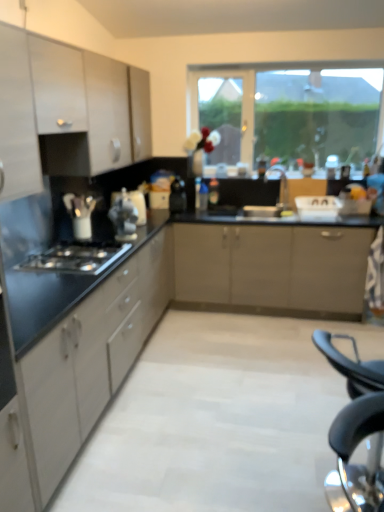
Question: Could you tell me if white glossy kettle at center, placed as the second appliance when sorted from right to left, is facing matte black countertop at left, which ranks as the first cabinetry in bottom-to-top order?

Choices:
 (A) yes
 (B) no

Answer: (B)

Question: From a real-world perspective, is white glossy kettle at center, which is counted as the 3th appliance, starting from the left, positioned over matte black countertop at left, arranged as the third cabinetry when viewed from the top, based on gravity?

Choices:
 (A) yes
 (B) no

Answer: (A)

Question: Is white glossy kettle at center, acting as the 3th appliance starting from the front, taller than matte black countertop at left, which ranks as the first cabinetry in bottom-to-top order?

Choices:
 (A) yes
 (B) no

Answer: (B)

Question: Is white glossy kettle at center, the second appliance positioned from the back, smaller than matte black countertop at left, arranged as the third cabinetry when viewed from the top?

Choices:
 (A) yes
 (B) no

Answer: (A)

Question: Is white glossy kettle at center, placed as the second appliance when sorted from right to left, behind matte black countertop at left, which ranks as the first cabinetry in bottom-to-top order?

Choices:
 (A) yes
 (B) no

Answer: (A)

Question: Looking at their shapes, would you say matte black countertop at left, arranged as the third cabinetry when viewed from the top, is wider or thinner than matte white cabinet at left, which ranks as the 2th cabinetry in top-to-bottom order?

Choices:
 (A) wide
 (B) thin

Answer: (A)

Question: Visually, is matte black countertop at left, which ranks as the first cabinetry in bottom-to-top order, positioned to the left or to the right of matte white cabinet at left, which ranks as the 2th cabinetry in top-to-bottom order?

Choices:
 (A) left
 (B) right

Answer: (B)

Question: From their relative heights in the image, would you say matte black countertop at left, arranged as the third cabinetry when viewed from the top, is taller or shorter than matte white cabinet at left, which ranks as the 2th cabinetry in top-to-bottom order?

Choices:
 (A) short
 (B) tall

Answer: (B)

Question: Is point (89, 423) closer or farther from the camera than point (21, 48)?

Choices:
 (A) closer
 (B) farther

Answer: (B)

Question: Does point (41, 66) appear closer or farther from the camera than point (357, 401)?

Choices:
 (A) closer
 (B) farther

Answer: (B)

Question: In terms of size, does satin silver cabinet at upper left, marked as the 3th cabinetry in a bottom-to-top arrangement, appear bigger or smaller than black plastic folding chair at lower right?

Choices:
 (A) small
 (B) big

Answer: (B)

Question: From the image's perspective, is satin silver cabinet at upper left, marked as the 3th cabinetry in a bottom-to-top arrangement, positioned above or below black plastic folding chair at lower right?

Choices:
 (A) below
 (B) above

Answer: (B)

Question: Is satin silver cabinet at upper left, marked as the 3th cabinetry in a bottom-to-top arrangement, to the left or to the right of black plastic folding chair at lower right in the image?

Choices:
 (A) left
 (B) right

Answer: (A)

Question: Is matte silver faucet at center wider or thinner than black plastic folding chair at lower right?

Choices:
 (A) wide
 (B) thin

Answer: (B)

Question: From a real-world perspective, is matte silver faucet at center positioned above or below black plastic folding chair at lower right?

Choices:
 (A) below
 (B) above

Answer: (B)